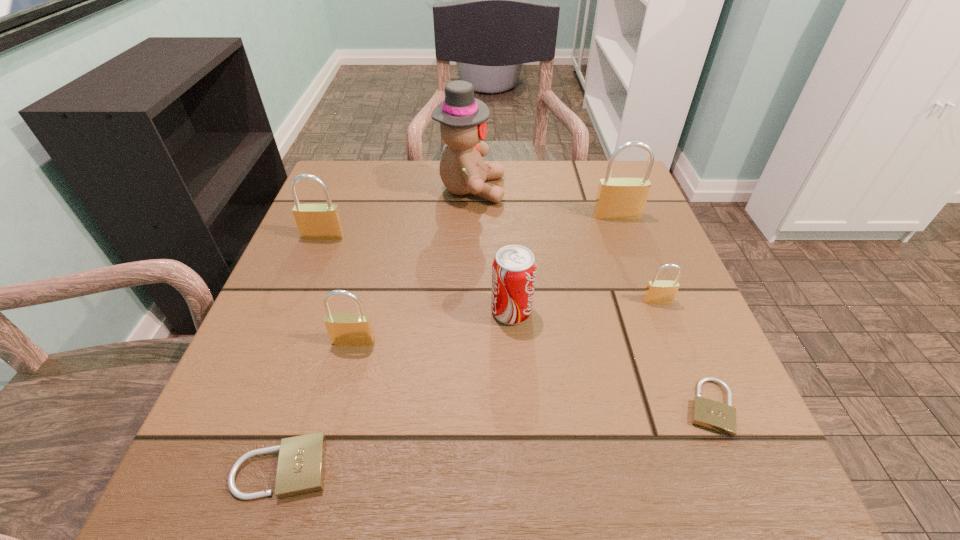
This screenshot has height=540, width=960. I want to click on the tallest object, so click(x=462, y=118).

The width and height of the screenshot is (960, 540). Identify the location of the farthest brass padlock. (617, 198).

Where is `the biggest brass padlock`? The image size is (960, 540). the biggest brass padlock is located at coordinates (617, 198).

Where is `the sixth nearest object`? Image resolution: width=960 pixels, height=540 pixels. the sixth nearest object is located at coordinates pyautogui.click(x=315, y=221).

Locate an element on the screen. The width and height of the screenshot is (960, 540). the second farthest padlock is located at coordinates (315, 221).

I want to click on soda can, so 514,267.

Identify the location of the third brass padlock from right to left. Image resolution: width=960 pixels, height=540 pixels. (345, 329).

Find the location of a particular element. The width and height of the screenshot is (960, 540). the nearest brass padlock is located at coordinates (345, 329).

I want to click on the smallest brass padlock, so click(x=657, y=291).

Identify the location of the third shortest object. The image size is (960, 540). (657, 291).